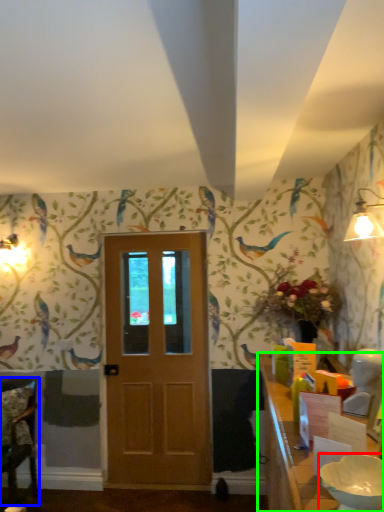
Question: Which object is the closest to the bowl (highlighted by a red box)? Choose among these: chair (highlighted by a blue box) or table (highlighted by a green box).

Choices:
 (A) chair
 (B) table

Answer: (B)